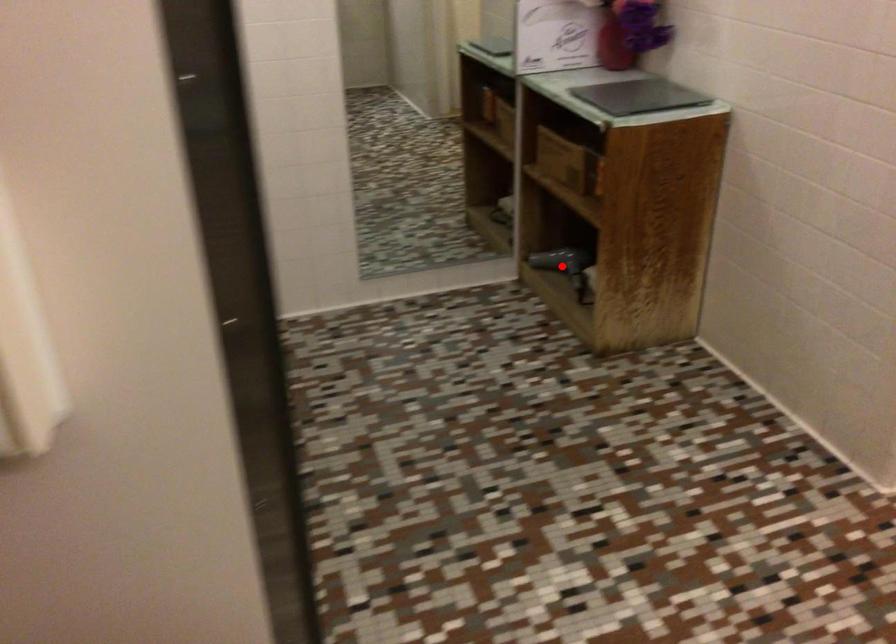
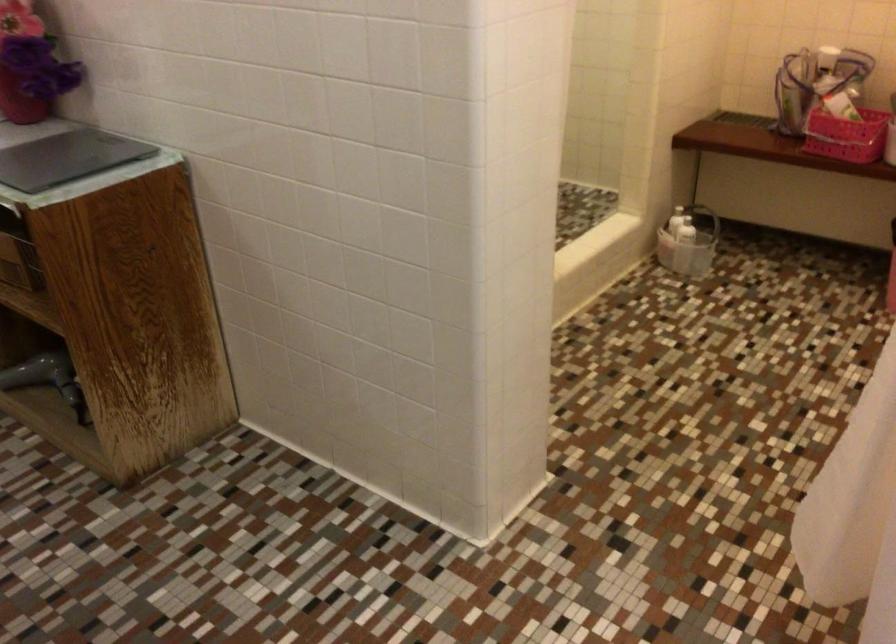
In the second image, find the point that corresponds to the highlighted location in the first image.

(47, 379)